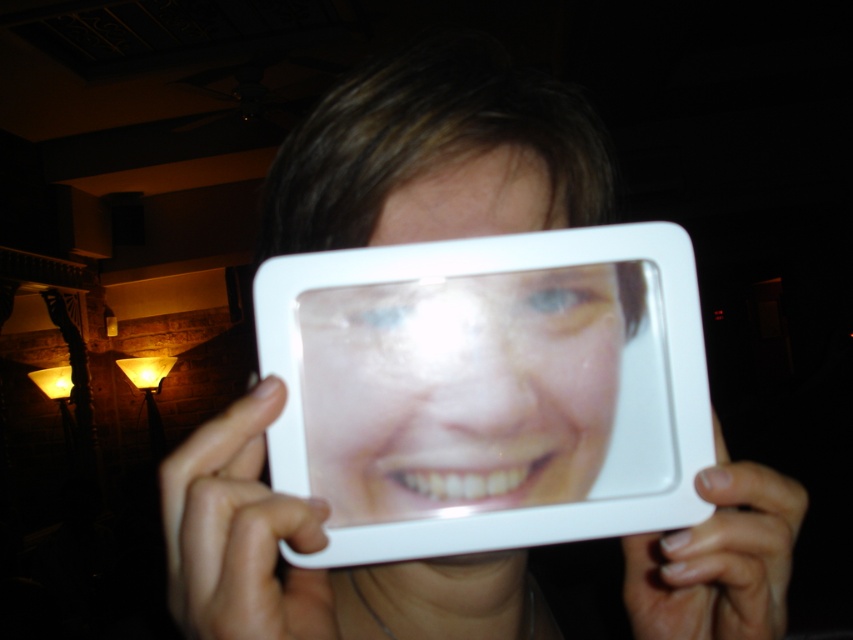
Between point (218, 589) and point (293, 620), which one is positioned in front?

Point (218, 589) is more forward.

How much distance is there between white plastic frame at center and white matte phone at center?

white plastic frame at center is 9.76 centimeters away from white matte phone at center.

Is point (490, 602) farther from viewer compared to point (259, 564)?

Yes, point (490, 602) is farther from viewer.

The width and height of the screenshot is (853, 640). In order to click on white plastic frame at center in this screenshot , I will do `click(434, 156)`.

Which of these two, matte plastic face at center or white matte phone at center, stands shorter?

With less height is matte plastic face at center.

What do you see at coordinates (460, 390) in the screenshot?
I see `matte plastic face at center` at bounding box center [460, 390].

Where is `matte plastic face at center`? The width and height of the screenshot is (853, 640). matte plastic face at center is located at coordinates (460, 390).

Identify the location of matte plastic face at center. Image resolution: width=853 pixels, height=640 pixels. (460, 390).

Is white matte phone at center to the left of white matte plastic at lower right from the viewer's perspective?

Correct, you'll find white matte phone at center to the left of white matte plastic at lower right.

Can you confirm if white matte phone at center is bigger than white matte plastic at lower right?

Yes, white matte phone at center is bigger than white matte plastic at lower right.

Is point (267, 524) more distant than point (735, 529)?

That is False.

I want to click on white matte phone at center, so click(239, 532).